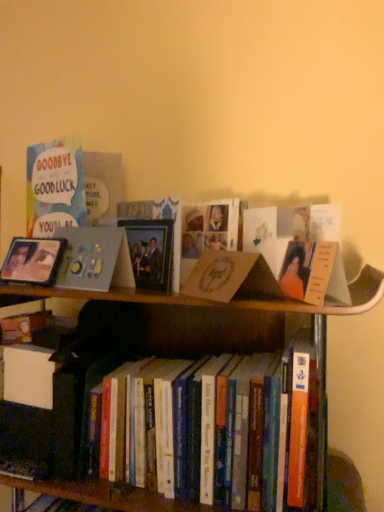
Question: From a real-world perspective, is brown cardboard book at center located beneath matte silver picture frame at left?

Choices:
 (A) no
 (B) yes

Answer: (B)

Question: Is brown cardboard book at center not near matte silver picture frame at left?

Choices:
 (A) yes
 (B) no

Answer: (B)

Question: From a real-world perspective, is brown cardboard book at center over matte silver picture frame at left?

Choices:
 (A) yes
 (B) no

Answer: (B)

Question: Is brown cardboard book at center further to camera compared to matte silver picture frame at left?

Choices:
 (A) yes
 (B) no

Answer: (B)

Question: Does brown cardboard book at center have a larger size compared to matte silver picture frame at left?

Choices:
 (A) no
 (B) yes

Answer: (B)

Question: In terms of size, does matte silver picture frame at left appear bigger or smaller than hardcover books at center?

Choices:
 (A) small
 (B) big

Answer: (A)

Question: From a real-world perspective, is matte silver picture frame at left positioned above or below hardcover books at center?

Choices:
 (A) below
 (B) above

Answer: (B)

Question: From the image's perspective, is matte silver picture frame at left above or below hardcover books at center?

Choices:
 (A) below
 (B) above

Answer: (B)

Question: In the image, is matte silver picture frame at left on the left side or the right side of hardcover books at center?

Choices:
 (A) right
 (B) left

Answer: (B)

Question: Is brown cardboard book at center inside the boundaries of matte gray photo frame at upper left, or outside?

Choices:
 (A) inside
 (B) outside

Answer: (B)

Question: From a real-world perspective, is brown cardboard book at center positioned above or below matte gray photo frame at upper left?

Choices:
 (A) below
 (B) above

Answer: (A)

Question: Is brown cardboard book at center bigger or smaller than matte gray photo frame at upper left?

Choices:
 (A) big
 (B) small

Answer: (B)

Question: Visually, is brown cardboard book at center positioned to the left or to the right of matte gray photo frame at upper left?

Choices:
 (A) left
 (B) right

Answer: (B)

Question: In terms of size, does matte gray photo frame at upper left appear bigger or smaller than hardcover books at center?

Choices:
 (A) small
 (B) big

Answer: (A)

Question: From the image's perspective, is matte gray photo frame at upper left located above or below hardcover books at center?

Choices:
 (A) below
 (B) above

Answer: (B)